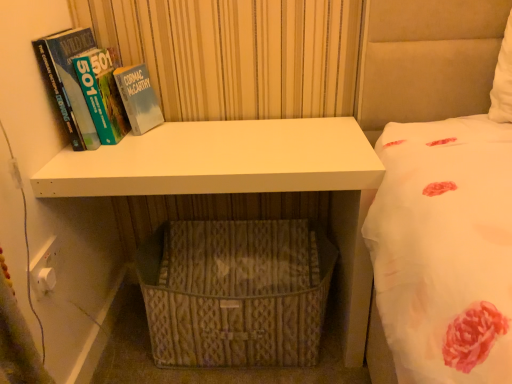
Question: In the image, is white matte shelf at center positioned in front of or behind woven beige basket at lower center?

Choices:
 (A) front
 (B) behind

Answer: (A)

Question: Is white matte shelf at center situated inside woven beige basket at lower center or outside?

Choices:
 (A) inside
 (B) outside

Answer: (A)

Question: Which object is positioned closest to the hardcover book at left?

Choices:
 (A) woven beige basket at lower center
 (B) white matte shelf at center

Answer: (B)

Question: Which is farther from the woven beige basket at lower center?

Choices:
 (A) hardcover book at left
 (B) white matte shelf at center

Answer: (A)